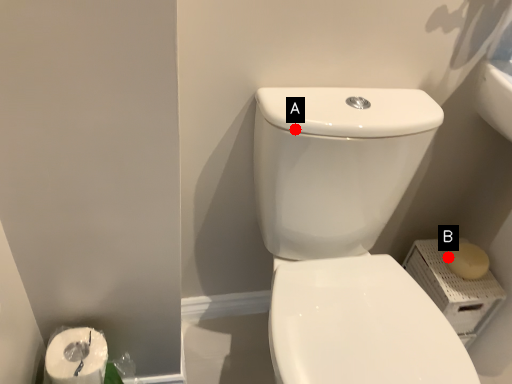
Question: Two points are circled on the image, labeled by A and B beside each circle. Among these points, which one is farthest from the camera?

Choices:
 (A) A is further
 (B) B is further

Answer: (B)